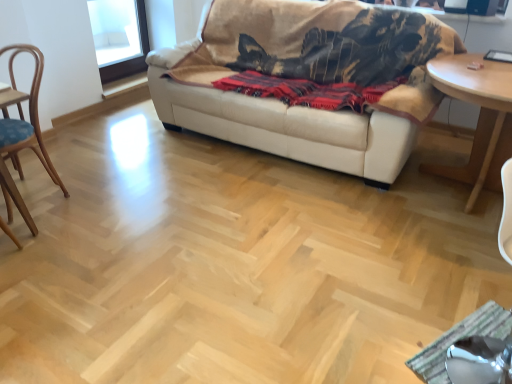
Question: In terms of size, does metallic silver swivel chair at lower right appear bigger or smaller than light brown wooden table at right?

Choices:
 (A) big
 (B) small

Answer: (B)

Question: From a real-world perspective, relative to light brown wooden table at right, is metallic silver swivel chair at lower right vertically above or below?

Choices:
 (A) below
 (B) above

Answer: (B)

Question: Which object is positioned closest to the red woven blanket at center?

Choices:
 (A) beige leather couch at upper center
 (B) wooden chair at left
 (C) metallic silver swivel chair at lower right
 (D) light brown wooden table at right

Answer: (A)

Question: Considering the real-world distances, which object is farthest from the beige leather couch at upper center?

Choices:
 (A) light brown wooden table at right
 (B) metallic silver swivel chair at lower right
 (C) red woven blanket at center
 (D) wooden chair at left

Answer: (B)